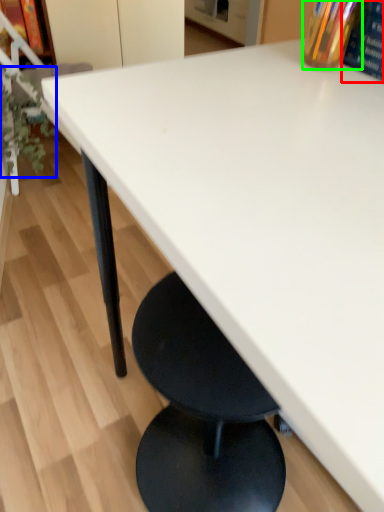
Question: Which object is the closest to the paperback book (highlighted by a red box)? Choose among these: plant (highlighted by a blue box) or bottle (highlighted by a green box).

Choices:
 (A) plant
 (B) bottle

Answer: (B)